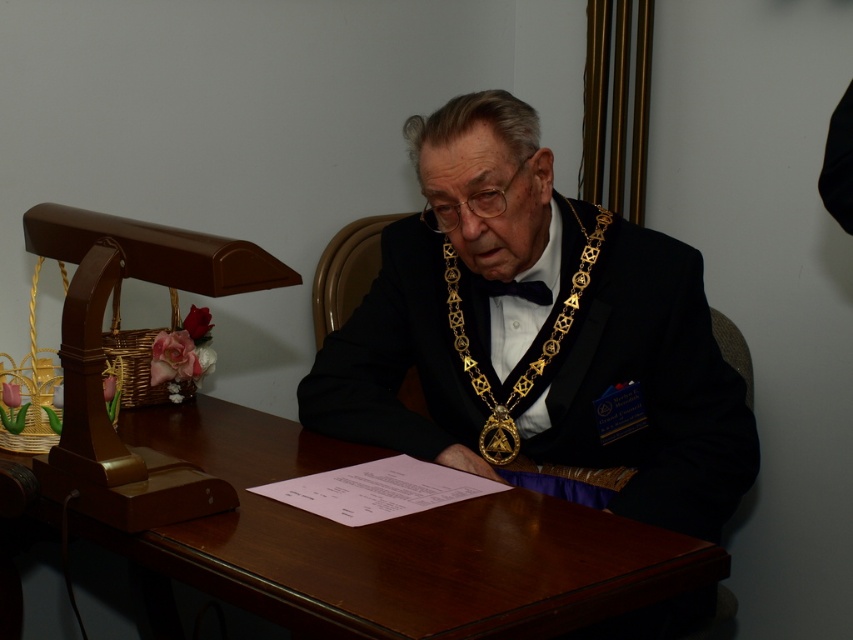
Question: Which point is closer to the camera taking this photo?

Choices:
 (A) (509, 492)
 (B) (560, 317)

Answer: (A)

Question: Can you confirm if gold metallic chain at center is thinner than black satin bow tie at center?

Choices:
 (A) yes
 (B) no

Answer: (B)

Question: Is black satin suit at center to the left of brown wood table at center from the viewer's perspective?

Choices:
 (A) no
 (B) yes

Answer: (A)

Question: Can you confirm if black satin suit at center is thinner than black satin bow tie at center?

Choices:
 (A) yes
 (B) no

Answer: (B)

Question: Among these points, which one is farthest from the camera?

Choices:
 (A) (459, 333)
 (B) (704, 381)

Answer: (A)

Question: Which object appears closest to the camera in this image?

Choices:
 (A) gold metallic chain at center
 (B) black satin suit at center
 (C) black satin bow tie at center

Answer: (B)